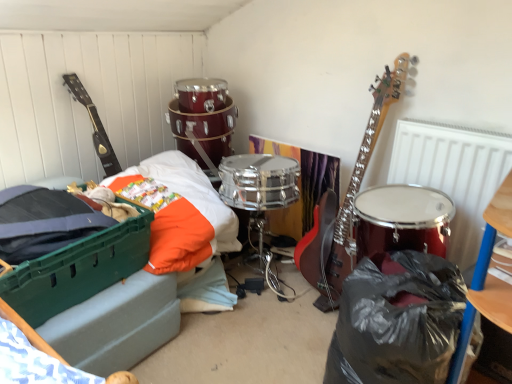
This screenshot has height=384, width=512. What do you see at coordinates (453, 173) in the screenshot? I see `metallic silver radiator at upper right` at bounding box center [453, 173].

Where is `metallic silver radiator at upper right`? This screenshot has width=512, height=384. metallic silver radiator at upper right is located at coordinates (453, 173).

What do you see at coordinates (145, 277) in the screenshot?
I see `green plastic bed at lower left` at bounding box center [145, 277].

What do you see at coordinates (488, 278) in the screenshot? I see `black plastic bag at lower right` at bounding box center [488, 278].

What do you see at coordinates (78, 269) in the screenshot? This screenshot has height=384, width=512. I see `green plastic storage box at left` at bounding box center [78, 269].

Measure the distance between point (96, 273) and camera.

The distance of point (96, 273) from camera is 4.80 feet.

I want to click on metallic silver radiator at upper right, so click(x=453, y=173).

Measure the distance between metallic silver radiator at upper right and black plastic bag at lower right.

They are 48.71 centimeters apart.

This screenshot has width=512, height=384. Identify the location of radiator that is above the black plastic bag at lower right (from a real-world perspective). (453, 173).

Could you tell me if metallic silver radiator at upper right is facing black plastic bag at lower right?

Yes, metallic silver radiator at upper right is turned towards black plastic bag at lower right.

Between green plastic bed at lower left and black plastic bag at lower right, which one has more height?

black plastic bag at lower right.

Which of these two, green plastic bed at lower left or black plastic bag at lower right, is wider?

With larger width is green plastic bed at lower left.

Find the location of `garbage above the green plastic bed at lower left (from a real-world perspective)`. garbage above the green plastic bed at lower left (from a real-world perspective) is located at coordinates (397, 321).

Is matte black guitar at left aimed at green plastic bed at lower left?

No, matte black guitar at left does not turn towards green plastic bed at lower left.

Consider the image. What's the angular difference between matte black guitar at left and green plastic bed at lower left's facing directions?

The angle between the facing direction of matte black guitar at left and the facing direction of green plastic bed at lower left is 0.00125 degrees.

Is matte black guitar at left at the left side of green plastic bed at lower left?

Indeed, matte black guitar at left is positioned on the left side of green plastic bed at lower left.

Does green plastic bed at lower left have a smaller size compared to metallic silver radiator at upper right?

No, green plastic bed at lower left is not smaller than metallic silver radiator at upper right.

From the image's perspective, which is above, green plastic bed at lower left or metallic silver radiator at upper right?

metallic silver radiator at upper right is shown above in the image.

Considering the relative positions of green plastic bed at lower left and metallic silver radiator at upper right in the image provided, is green plastic bed at lower left behind metallic silver radiator at upper right?

That is False.

Considering the relative sizes of green plastic bed at lower left and metallic silver radiator at upper right in the image provided, is green plastic bed at lower left taller than metallic silver radiator at upper right?

No.

Between black plastic bag at lower right and green plastic bed at lower left, which one has larger size?

green plastic bed at lower left is bigger.

From the image's perspective, relative to green plastic bed at lower left, is black plastic bag at lower right above or below?

black plastic bag at lower right is below green plastic bed at lower left.

Is black plastic bag at lower right wider than green plastic bed at lower left?

No.

Find the location of a particular element. garbage above the green plastic bed at lower left (from a real-world perspective) is located at coordinates (397, 321).

In the image, is black plastic bag at lower right positioned in front of or behind metallic silver radiator at upper right?

black plastic bag at lower right is positioned closer to the viewer than metallic silver radiator at upper right.

How different are the orientations of black plastic bag at lower right and metallic silver radiator at upper right in degrees?

The angle between the facing direction of black plastic bag at lower right and the facing direction of metallic silver radiator at upper right is 0.00178 degrees.

From the image's perspective, is black plastic bag at lower right above metallic silver radiator at upper right?

No, from the image's perspective, black plastic bag at lower right is not over metallic silver radiator at upper right.

Image resolution: width=512 pixels, height=384 pixels. I want to click on furniture below the green plastic storage box at left (from a real-world perspective), so click(488, 278).

From the image's perspective, which one is positioned lower, black plastic bag at lower right or green plastic storage box at left?

black plastic bag at lower right.

Can you confirm if black plastic bag at lower right is thinner than green plastic storage box at left?

Correct, the width of black plastic bag at lower right is less than that of green plastic storage box at left.

At what (x,y) coordinates should I click in order to perform the action: click on radiator behind the black plastic bag at lower right. Please return your answer as a coordinate pair (x, y). Looking at the image, I should click on pos(453,173).

The height and width of the screenshot is (384, 512). What are the coordinates of `garbage on the right side of green plastic bed at lower left` in the screenshot? It's located at (397, 321).

Considering their positions, is green plastic storage box at left positioned further to black plastic bag at lower right than matte black guitar at left?

matte black guitar at left is further to black plastic bag at lower right.

Which object lies further to the anchor point matte black guitar at left, green plastic bed at lower left or metallic silver radiator at upper right?

Among the two, metallic silver radiator at upper right is located further to matte black guitar at left.

From the image, which object appears to be nearer to green plastic bed at lower left, green plastic storage box at left or black plastic bag at lower right?

Among the two, green plastic storage box at left is located nearer to green plastic bed at lower left.

Based on their spatial positions, is black plastic bag at lower right or black plastic bag at lower right closer to metallic silver radiator at upper right?

The object closer to metallic silver radiator at upper right is black plastic bag at lower right.

Estimate the real-world distances between objects in this image. Which object is closer to green plastic storage box at left, green plastic bed at lower left or black plastic bag at lower right?

green plastic bed at lower left is positioned closer to the anchor green plastic storage box at left.

From the image, which object appears to be farther from black plastic bag at lower right, green plastic bed at lower left or metallic silver radiator at upper right?

green plastic bed at lower left.

From the image, which object appears to be farther from green plastic storage box at left, green plastic bed at lower left or black plastic bag at lower right?

black plastic bag at lower right.

Based on their spatial positions, is black plastic bag at lower right or green plastic bed at lower left closer to matte black guitar at left?

Based on the image, green plastic bed at lower left appears to be nearer to matte black guitar at left.

Find the location of a particular element. Image resolution: width=512 pixels, height=384 pixels. garbage between green plastic storage box at left and metallic silver radiator at upper right is located at coordinates (397, 321).

This screenshot has height=384, width=512. I want to click on radiator between green plastic bed at lower left and black plastic bag at lower right in the horizontal direction, so click(453, 173).

I want to click on bed between matte black guitar at left and black plastic bag at lower right in the horizontal direction, so click(x=145, y=277).

I want to click on furniture between metallic silver radiator at upper right and black plastic bag at lower right in the up-down direction, so click(x=488, y=278).